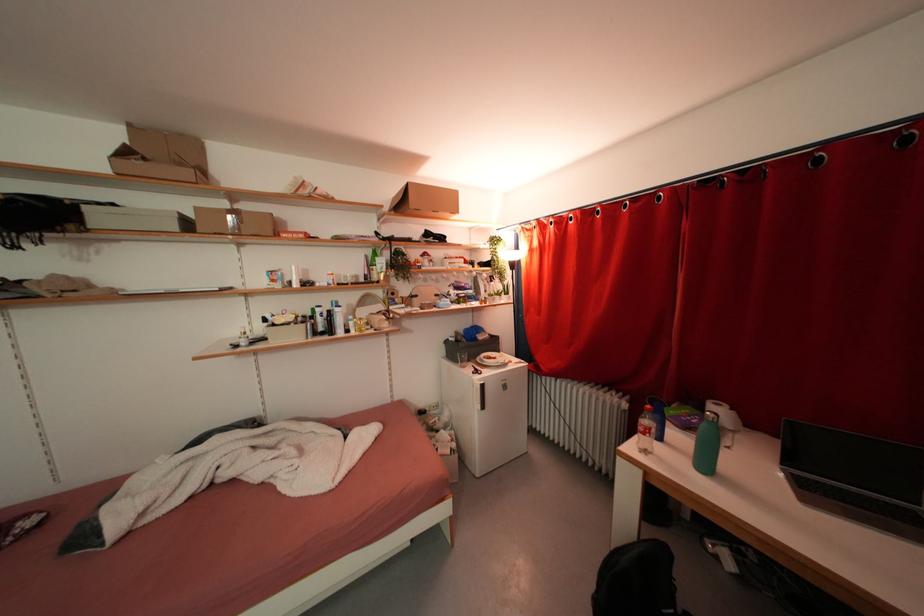
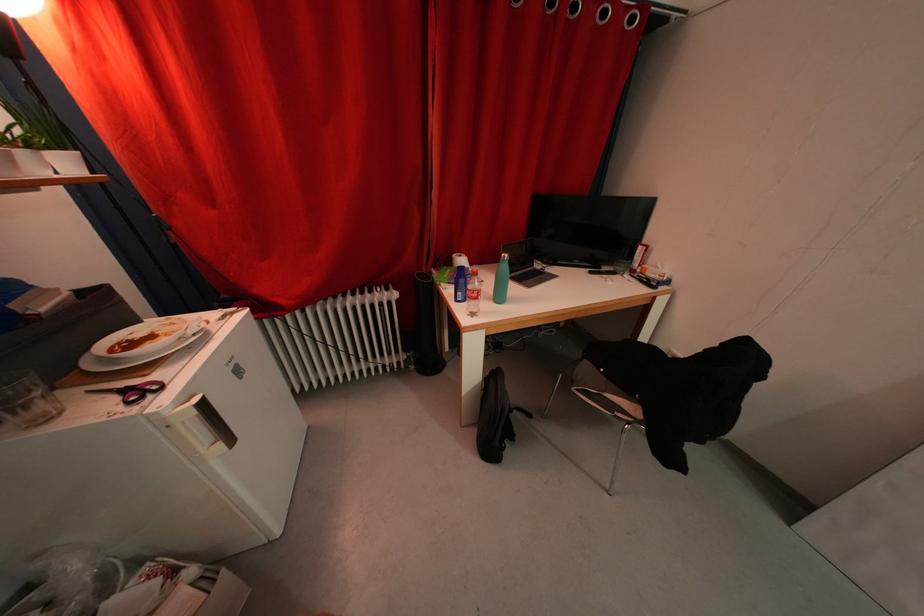
Find the pixel in the second image that matches point 500,362 in the first image.

(157, 341)